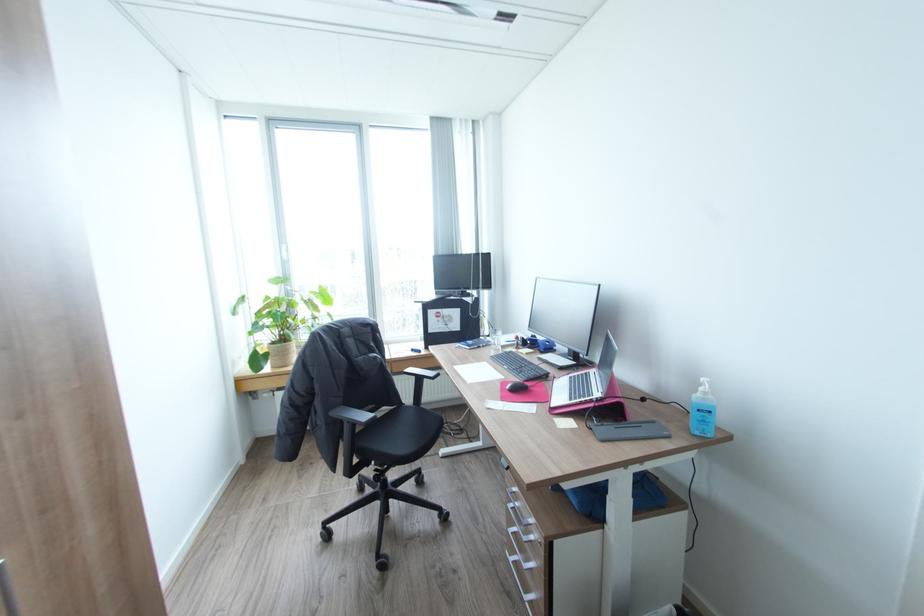
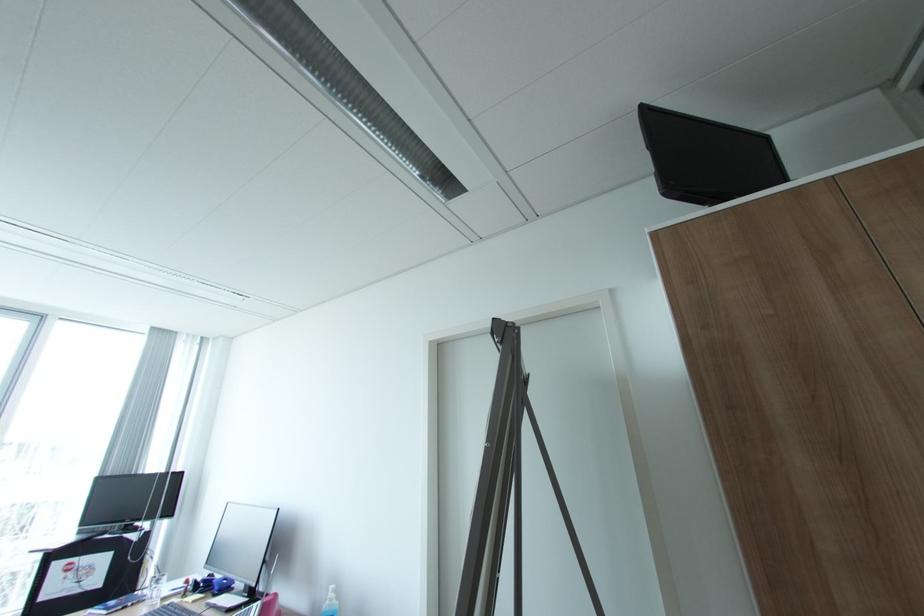
Find the pixel in the second image that matches [710,392] in the first image.

(336, 599)